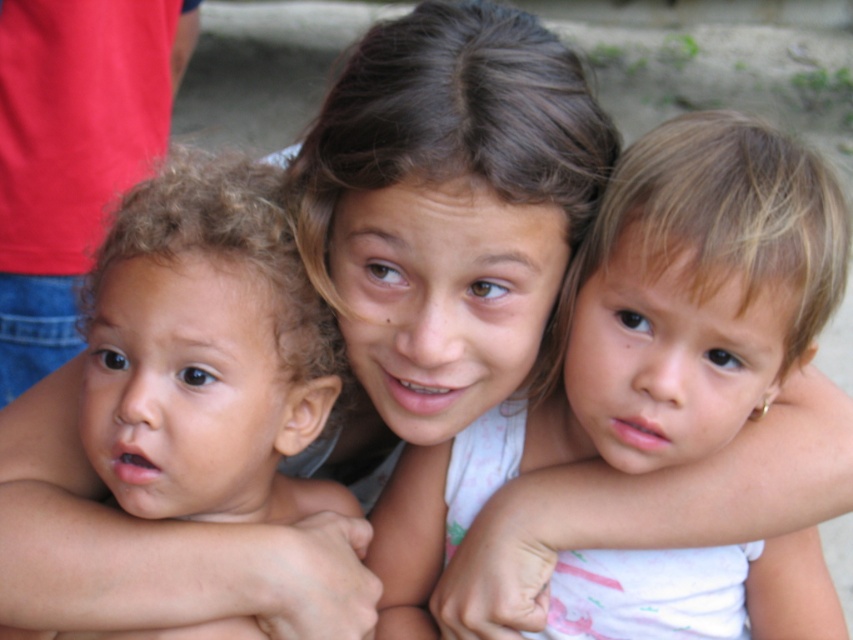
Between smooth skin child at center and white fabric at upper center, which one is positioned lower?

white fabric at upper center

Is smooth skin child at center to the left of white fabric at upper center from the viewer's perspective?

No, smooth skin child at center is not to the left of white fabric at upper center.

Between point (614, 326) and point (611, 476), which one is positioned in front?

Point (614, 326) is in front.

Image resolution: width=853 pixels, height=640 pixels. Find the location of `smooth skin child at center`. smooth skin child at center is located at coordinates (643, 336).

In the scene shown: Is the position of curly hair at left more distant than that of white fabric at upper center?

That is False.

Where is `curly hair at left`? curly hair at left is located at coordinates click(206, 349).

Does smooth skin child at center appear under curly hair at left?

Yes, smooth skin child at center is below curly hair at left.

Can you confirm if smooth skin child at center is positioned to the right of curly hair at left?

Indeed, smooth skin child at center is positioned on the right side of curly hair at left.

Which is behind, point (727, 150) or point (169, 371)?

The point (727, 150) is more distant.

Where is `smooth skin child at center`? The height and width of the screenshot is (640, 853). smooth skin child at center is located at coordinates (643, 336).